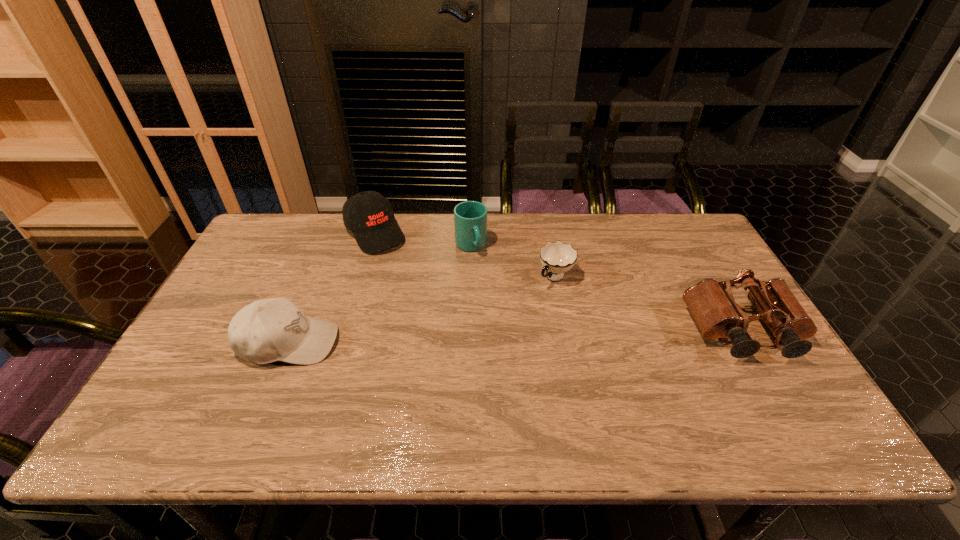
Where is `the nearer baseball cap`? the nearer baseball cap is located at coordinates click(x=268, y=330).

This screenshot has height=540, width=960. Find the location of `the rightmost object`. the rightmost object is located at coordinates pos(713,308).

Identify the location of the shorter cup. (557, 258).

Locate an element on the screen. the second object from right to left is located at coordinates (557, 258).

Where is `the farther baseball cap`? The width and height of the screenshot is (960, 540). the farther baseball cap is located at coordinates (369, 215).

Where is `the third object from left to right`? This screenshot has width=960, height=540. the third object from left to right is located at coordinates (470, 217).

Find the location of a particular element. the taller cup is located at coordinates (470, 217).

At what (x,y) coordinates should I click in order to perform the action: click on free location located on the front-facing side of the nearer baseball cap. Please return your answer as a coordinate pair (x, y). Image resolution: width=960 pixels, height=540 pixels. Looking at the image, I should click on (421, 342).

Find the location of `free space located 0.340m on the side of the shorter cup with the handle`. free space located 0.340m on the side of the shorter cup with the handle is located at coordinates (474, 361).

Identify the location of vacant area situated on the side of the shorter cup with the handle. (537, 298).